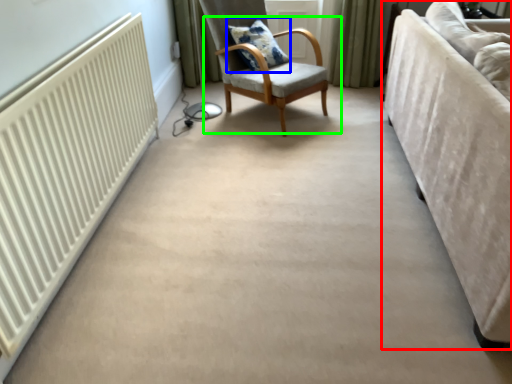
Question: Considering the real-world distances, which object is farthest from studio couch (highlighted by a red box)? pillow (highlighted by a blue box) or chair (highlighted by a green box)?

Choices:
 (A) pillow
 (B) chair

Answer: (A)